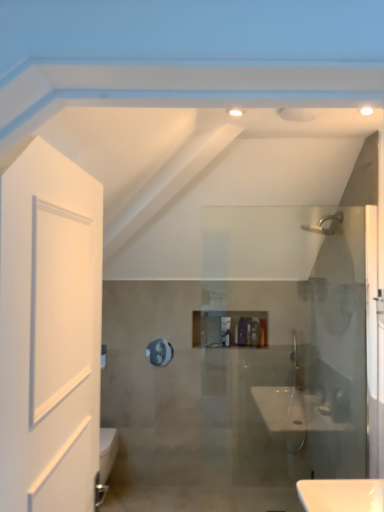
Locate an element on the screen. metallic reflective mirror at center is located at coordinates (159, 352).

Locate an element on the screen. This screenshot has width=384, height=512. matte purple bottle at center is located at coordinates (255, 333).

From the image's perspective, which one is positioned higher, matte silver faucet at upper right or matte purple bottle at center?

matte silver faucet at upper right appears higher in the image.

In the scene shown: Is matte silver faucet at upper right aimed at matte purple bottle at center?

No, matte silver faucet at upper right is not facing towards matte purple bottle at center.

Locate an element on the screen. This screenshot has width=384, height=512. toiletry behind the matte silver faucet at upper right is located at coordinates (255, 333).

How many degrees apart are the facing directions of metallic reflective mirror at center and matte silver faucet at upper right?

The facing directions of metallic reflective mirror at center and matte silver faucet at upper right are 88.9 degrees apart.

The image size is (384, 512). I want to click on mirror that is under the matte silver faucet at upper right (from a real-world perspective), so click(x=159, y=352).

From the picture: From the image's perspective, is metallic reflective mirror at center located beneath matte silver faucet at upper right?

Indeed, from the image's perspective, metallic reflective mirror at center is shown beneath matte silver faucet at upper right.

Is metallic reflective mirror at center in contact with matte silver faucet at upper right?

metallic reflective mirror at center is not next to matte silver faucet at upper right, and they're not touching.

From the image's perspective, is white matte door at left positioned above or below matte silver faucet at upper right?

From the image's perspective, white matte door at left appears below matte silver faucet at upper right.

Considering the sizes of objects white matte door at left and matte silver faucet at upper right in the image provided, who is thinner, white matte door at left or matte silver faucet at upper right?

With smaller width is white matte door at left.

In the scene shown: Is white matte door at left turned away from matte silver faucet at upper right?

No, white matte door at left is not facing away from matte silver faucet at upper right.

From the image's perspective, which one is positioned higher, matte purple bottle at center or white matte door at left?

white matte door at left, from the image's perspective.

Which of these two, matte purple bottle at center or white matte door at left, stands shorter?

matte purple bottle at center is shorter.

Is matte purple bottle at center not inside white matte door at left?

Yes, matte purple bottle at center is located beyond the bounds of white matte door at left.

At what (x,y) coordinates should I click in order to perform the action: click on toiletry below the matte silver faucet at upper right (from the image's perspective). Please return your answer as a coordinate pair (x, y). The width and height of the screenshot is (384, 512). Looking at the image, I should click on (255, 333).

Is matte purple bottle at center smaller than matte silver faucet at upper right?

Indeed, matte purple bottle at center has a smaller size compared to matte silver faucet at upper right.

Considering the positions of point (251, 333) and point (315, 232), is point (251, 333) closer or farther from the camera than point (315, 232)?

Point (251, 333) appears to be farther away from the viewer than point (315, 232).

From the image's perspective, which object appears higher, matte purple bottle at center or matte silver faucet at upper right?

From the image's view, matte silver faucet at upper right is above.

Considering the relative sizes of metallic reflective mirror at center and white matte door at left in the image provided, is metallic reflective mirror at center wider than white matte door at left?

No, metallic reflective mirror at center is not wider than white matte door at left.

Between metallic reflective mirror at center and white matte door at left, which one has more height?

white matte door at left.

Would you say metallic reflective mirror at center is outside white matte door at left?

Yes, metallic reflective mirror at center is outside of white matte door at left.

Does white matte door at left have a lesser width compared to matte purple bottle at center?

In fact, white matte door at left might be wider than matte purple bottle at center.

Considering the relative sizes of white matte door at left and matte purple bottle at center in the image provided, is white matte door at left bigger than matte purple bottle at center?

Indeed, white matte door at left has a larger size compared to matte purple bottle at center.

Considering the positions of points (28, 436) and (252, 332), is point (28, 436) closer to camera compared to point (252, 332)?

That is True.

What are the coordinates of `shower in front of the matte purple bottle at center` in the screenshot? It's located at pos(324,222).

Locate an element on the screen. shower on the right of metallic reflective mirror at center is located at coordinates (324, 222).

From the image, which object appears to be nearer to metallic reflective mirror at center, matte silver faucet at upper right or white matte door at left?

Among the two, matte silver faucet at upper right is located nearer to metallic reflective mirror at center.

When comparing their distances from matte silver faucet at upper right, does white matte door at left or matte purple bottle at center seem closer?

matte purple bottle at center is closer to matte silver faucet at upper right.

In the scene shown: Based on their spatial positions, is metallic reflective mirror at center or matte purple bottle at center further from white matte door at left?

matte purple bottle at center.

From the image, which object appears to be nearer to matte purple bottle at center, white matte door at left or matte silver faucet at upper right?

The object closer to matte purple bottle at center is matte silver faucet at upper right.

When comparing their distances from matte purple bottle at center, does matte silver faucet at upper right or white matte door at left seem closer?

Based on the image, matte silver faucet at upper right appears to be nearer to matte purple bottle at center.

Which object lies nearer to the anchor point metallic reflective mirror at center, matte purple bottle at center or white matte door at left?

matte purple bottle at center is positioned closer to the anchor metallic reflective mirror at center.

Considering their positions, is metallic reflective mirror at center positioned further to matte silver faucet at upper right than matte purple bottle at center?

The object further to matte silver faucet at upper right is metallic reflective mirror at center.

Based on their spatial positions, is white matte door at left or metallic reflective mirror at center closer to matte silver faucet at upper right?

The object closer to matte silver faucet at upper right is metallic reflective mirror at center.

In order to click on shower between white matte door at left and metallic reflective mirror at center in the front-back direction in this screenshot , I will do `click(324, 222)`.

At what (x,y) coordinates should I click in order to perform the action: click on shower positioned between white matte door at left and matte purple bottle at center from near to far. Please return your answer as a coordinate pair (x, y). The height and width of the screenshot is (512, 384). Looking at the image, I should click on (324, 222).

Locate an element on the screen. The width and height of the screenshot is (384, 512). toiletry situated between metallic reflective mirror at center and matte silver faucet at upper right from left to right is located at coordinates (255, 333).

Find the location of a particular element. This screenshot has height=512, width=384. toiletry between white matte door at left and metallic reflective mirror at center in the front-back direction is located at coordinates (255, 333).